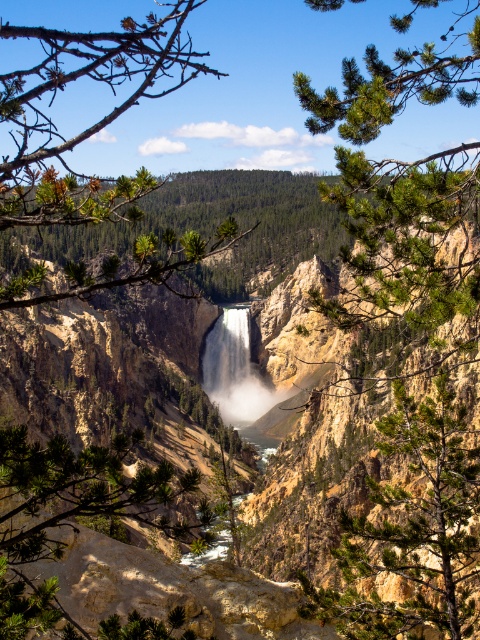
Question: Which object appears closest to the camera in this image?

Choices:
 (A) green needle-like leaves at center
 (B) white misty waterfall at center
 (C) green textured tree at center

Answer: (A)

Question: Which is farther from the green needle-like leaves at center?

Choices:
 (A) green textured tree at center
 (B) white misty waterfall at center

Answer: (B)

Question: Does green needle-like leaves at center come in front of green textured tree at center?

Choices:
 (A) yes
 (B) no

Answer: (A)

Question: Does green needle-like leaves at center have a smaller size compared to green textured tree at center?

Choices:
 (A) yes
 (B) no

Answer: (B)

Question: Is green needle-like leaves at center further to camera compared to white misty waterfall at center?

Choices:
 (A) no
 (B) yes

Answer: (A)

Question: Which point is farther from the camera taking this photo?

Choices:
 (A) (241, 349)
 (B) (147, 262)

Answer: (A)